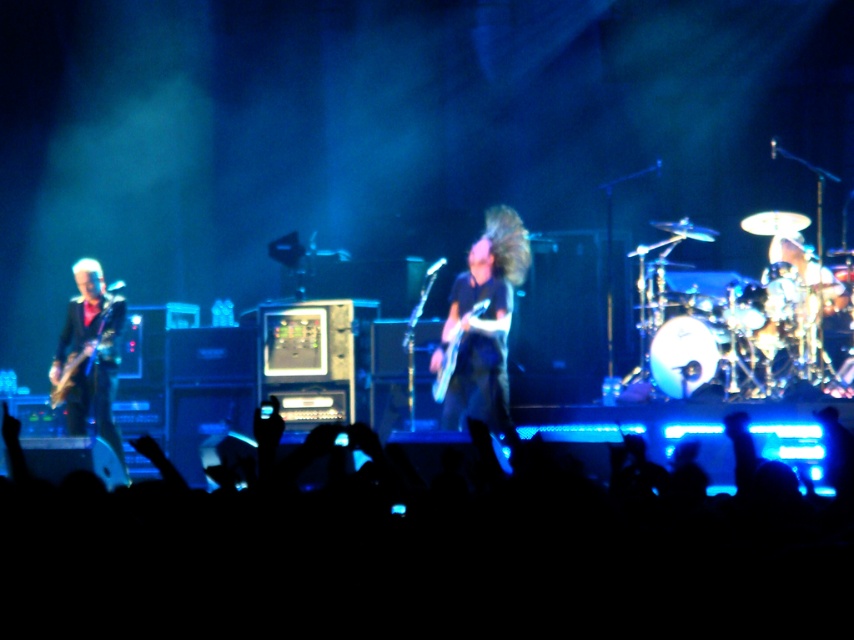
Is point (85, 369) positioned after point (51, 396)?

That is False.

Is point (71, 378) closer to camera compared to point (68, 380)?

That is False.

Locate an element on the screen. shiny black guitar at left is located at coordinates (x=89, y=355).

Which of these two, black silhouettes at lower center or shiny black guitar at left, stands shorter?

With less height is black silhouettes at lower center.

Is point (133, 572) positioned behind point (110, 360)?

That is False.

Between point (137, 500) and point (79, 310), which one is positioned in front?

Positioned in front is point (137, 500).

The height and width of the screenshot is (640, 854). In order to click on black silhouettes at lower center in this screenshot , I will do `click(414, 563)`.

In the scene shown: Which is more to the left, black silhouettes at lower center or shiny metallic guitar at center?

From the viewer's perspective, black silhouettes at lower center appears more on the left side.

Does point (234, 554) come farther from viewer compared to point (457, 326)?

No, (234, 554) is in front of (457, 326).

This screenshot has width=854, height=640. I want to click on black silhouettes at lower center, so click(x=414, y=563).